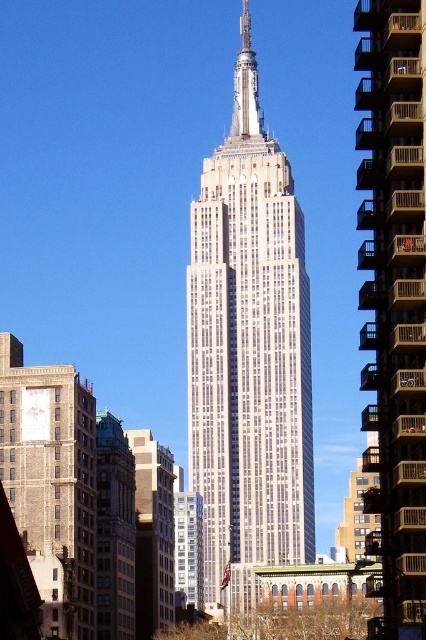
Is white stone building at center shorter than gray stone building at center?

No.

This screenshot has width=426, height=640. Describe the element at coordinates (249, 355) in the screenshot. I see `white stone building at center` at that location.

This screenshot has height=640, width=426. I want to click on white stone building at center, so click(249, 355).

Find the location of a particular element. The image size is (426, 640). white stone building at center is located at coordinates (249, 355).

Does white stone building at center appear over brown concrete building at right?

Correct, white stone building at center is located above brown concrete building at right.

Between white stone building at center and brown concrete building at right, which one has less height?

brown concrete building at right is shorter.

Who is more distant from viewer, (253, 72) or (383, 26)?

The point (253, 72) is more distant.

Where is `white stone building at center`? white stone building at center is located at coordinates (249, 355).

Between point (134, 492) and point (166, 484), which one is positioned in front?

Positioned in front is point (134, 492).

Between green patina copper tower at left and gray stone building at center, which one has less height?

Result: With less height is gray stone building at center.

Where is `green patina copper tower at left`? The height and width of the screenshot is (640, 426). green patina copper tower at left is located at coordinates (115, 531).